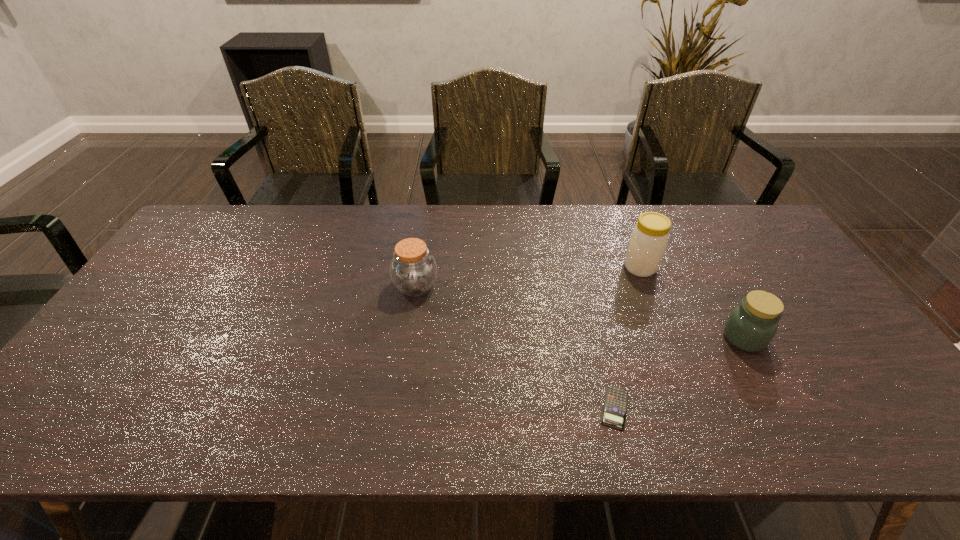
Find the location of a particular element. This screenshot has width=960, height=540. empty space that is in between the calculator and the tallest object is located at coordinates (628, 338).

Identify the location of vacant point located between the leftmost jar and the second object from right to left. The height and width of the screenshot is (540, 960). (528, 277).

The width and height of the screenshot is (960, 540). I want to click on vacant area that lies between the nearest jar and the leftmost object, so click(x=580, y=312).

The width and height of the screenshot is (960, 540). I want to click on vacant area that lies between the leftmost object and the rightmost jar, so click(580, 312).

Identify the location of empty space that is in between the second object from left to right and the second nearest object. (680, 373).

Identify the location of vacant region between the nearest jar and the leftmost object. (580, 312).

What are the coordinates of `vacant region between the second object from right to left and the second object from left to right` in the screenshot? It's located at (628, 338).

This screenshot has width=960, height=540. Find the location of `free spot between the third object from left to right and the third farthest object`. free spot between the third object from left to right and the third farthest object is located at coordinates (692, 302).

This screenshot has height=540, width=960. Find the location of `object that is the third closest to the third object from right to left`. object that is the third closest to the third object from right to left is located at coordinates (413, 270).

Select which object is the second closest to the third object from right to left. Please provide its 2D coordinates. Your answer should be formatted as a tuple, i.e. [(x, y)], where the tuple contains the x and y coordinates of a point satisfying the conditions above.

[(649, 238)]